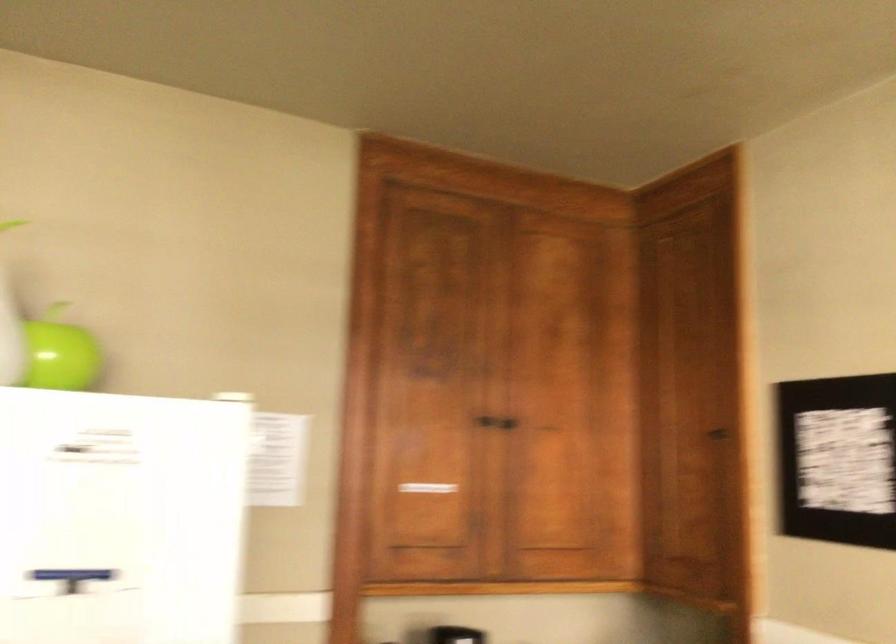
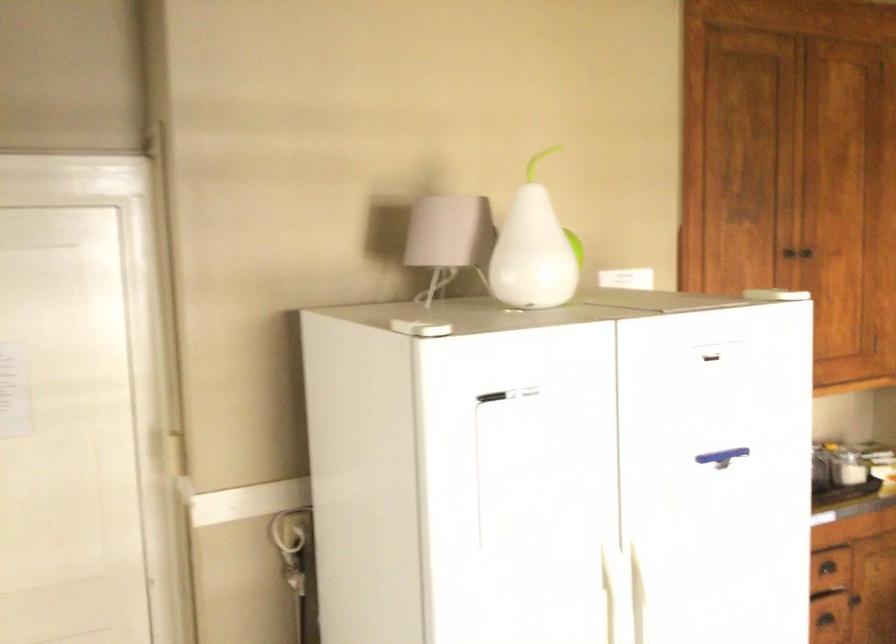
Locate, in the second image, the point that corresponds to point (464, 417) in the first image.

(786, 257)